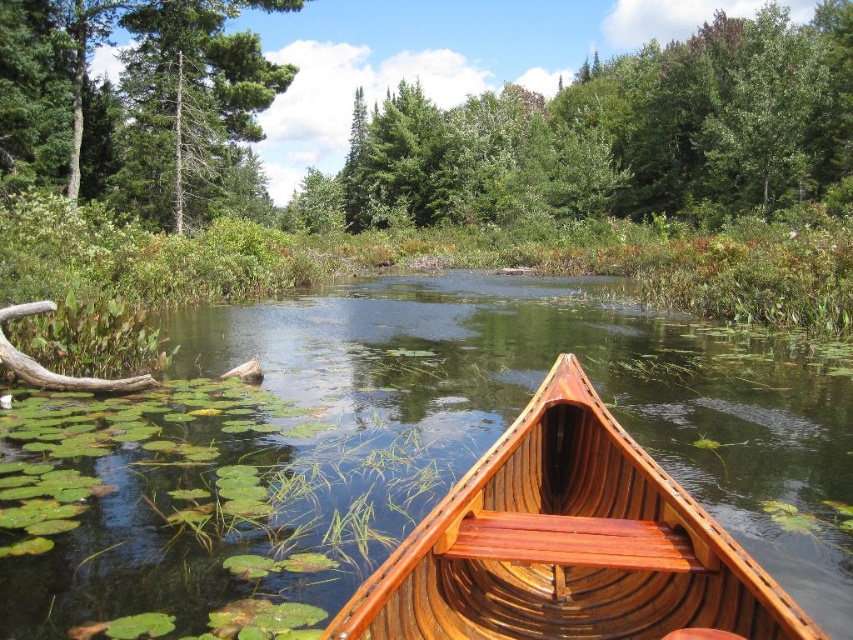
Between glossy wood canoe at center and green leafy tree at upper center, which one appears on the right side from the viewer's perspective?

From the viewer's perspective, green leafy tree at upper center appears more on the right side.

Based on the photo, which of these two, glossy wood canoe at center or green leafy tree at upper center, stands shorter?

glossy wood canoe at center

Is point (601, 342) farther from camera compared to point (569, 182)?

No, (601, 342) is in front of (569, 182).

The width and height of the screenshot is (853, 640). Identify the location of glossy wood canoe at center. (386, 451).

Who is lower down, shiny brown canoe at center or green matte tree at upper left?

shiny brown canoe at center

Measure the distance between shiny brown canoe at center and camera.

shiny brown canoe at center is 7.31 feet from camera.

You are a GUI agent. You are given a task and a screenshot of the screen. Output one action in this format:
    pyautogui.click(x=<x>, y=<y>)
    Task: Click on the shiny brown canoe at center
    The height and width of the screenshot is (640, 853).
    Given the screenshot: What is the action you would take?
    pyautogui.click(x=567, y=545)

Does green leafy tree at upper center have a lesser height compared to wooden paddle at center?

No.

Between green leafy tree at upper center and wooden paddle at center, which one is positioned lower?

Positioned lower is wooden paddle at center.

You are a GUI agent. You are given a task and a screenshot of the screen. Output one action in this format:
    pyautogui.click(x=<x>, y=<y>)
    Task: Click on the green leafy tree at upper center
    This screenshot has height=640, width=853.
    Given the screenshot: What is the action you would take?
    pos(612,134)